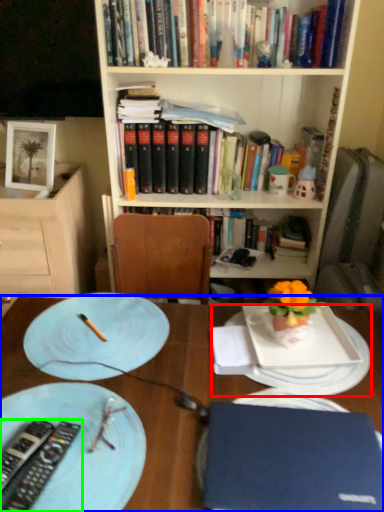
Question: Considering the real-world distances, which object is farthest from platter (highlighted by a red box)? desk (highlighted by a blue box) or remote control (highlighted by a green box)?

Choices:
 (A) desk
 (B) remote control

Answer: (B)